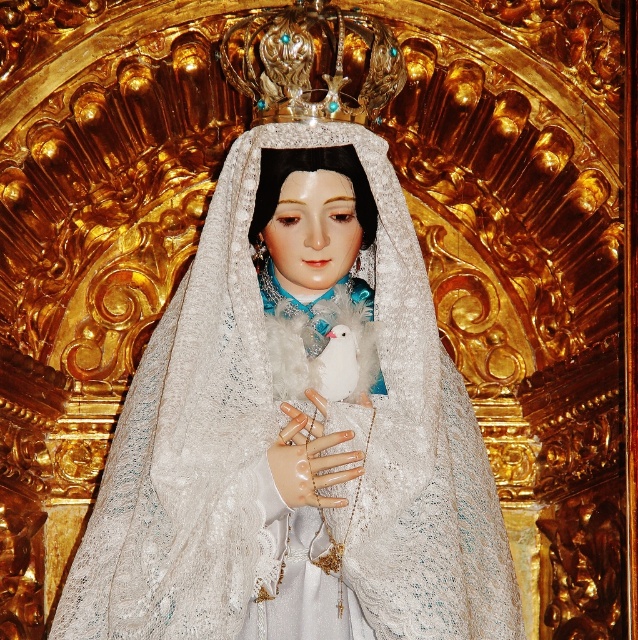
Question: Which object is the closest to the white fluffy bird at center?

Choices:
 (A) smooth porcelain hand at center
 (B) lace fabric at center

Answer: (A)

Question: Is lace fabric at center above smooth porcelain hand at center?

Choices:
 (A) yes
 (B) no

Answer: (A)

Question: In this image, where is lace fabric at center located relative to white fluffy bird at center?

Choices:
 (A) below
 (B) above

Answer: (B)

Question: Which object is closer to the camera taking this photo?

Choices:
 (A) smooth porcelain hand at center
 (B) lace fabric at center
 (C) white fluffy bird at center

Answer: (B)

Question: Which point is farther from the camera taking this photo?

Choices:
 (A) (346, 440)
 (B) (336, 188)
 (C) (338, 324)

Answer: (C)

Question: Can you confirm if smooth porcelain hand at center is positioned above white fluffy bird at center?

Choices:
 (A) no
 (B) yes

Answer: (A)